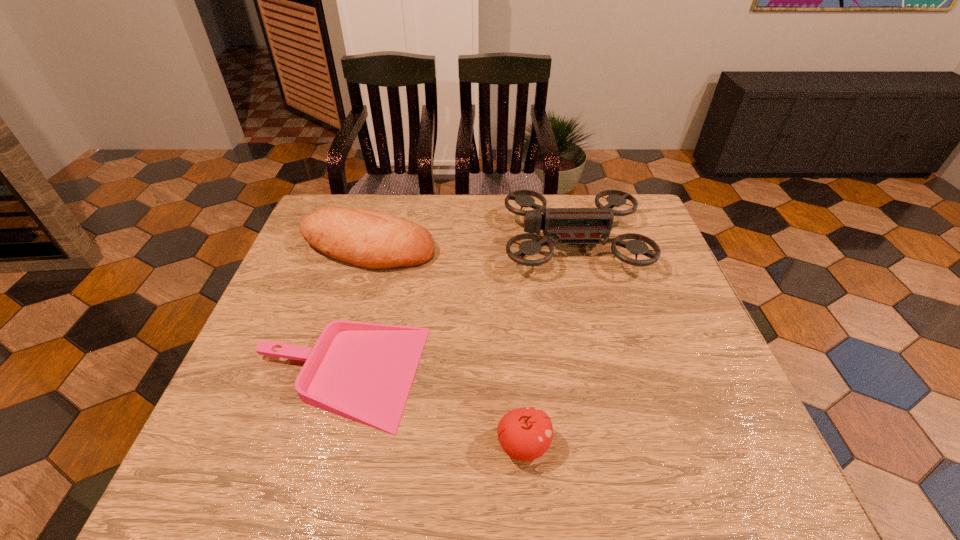
Locate an element on the screen. vacant region at the far left corner is located at coordinates (320, 204).

Where is `free space at the far right corner of the desktop`? This screenshot has width=960, height=540. free space at the far right corner of the desktop is located at coordinates (623, 233).

Identify the location of free space between the drone and the bread. (470, 245).

Identify the location of vacant area that lies between the apple and the dustpan. The image size is (960, 540). (431, 411).

Image resolution: width=960 pixels, height=540 pixels. In order to click on vacant area that lies between the bread and the drone in this screenshot , I will do `click(470, 245)`.

Find the location of a particular element. The height and width of the screenshot is (540, 960). vacant area that lies between the apple and the drone is located at coordinates (548, 344).

Where is `free area in between the drone and the dustpan`? free area in between the drone and the dustpan is located at coordinates (455, 310).

This screenshot has height=540, width=960. Find the location of `vacant area that lies between the drone and the bread`. vacant area that lies between the drone and the bread is located at coordinates (470, 245).

This screenshot has width=960, height=540. Find the location of `free point between the dustpan and the bread`. free point between the dustpan and the bread is located at coordinates (353, 313).

Where is `free spot between the apple and the drone`? This screenshot has width=960, height=540. free spot between the apple and the drone is located at coordinates (548, 344).